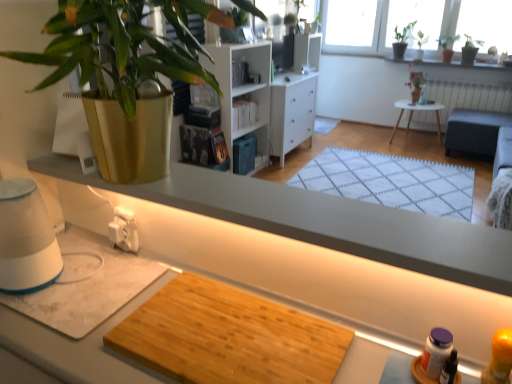
Identify the location of vacant space situated above wooden cutting board at center (from a real-world perspective). Image resolution: width=512 pixels, height=384 pixels. (229, 332).